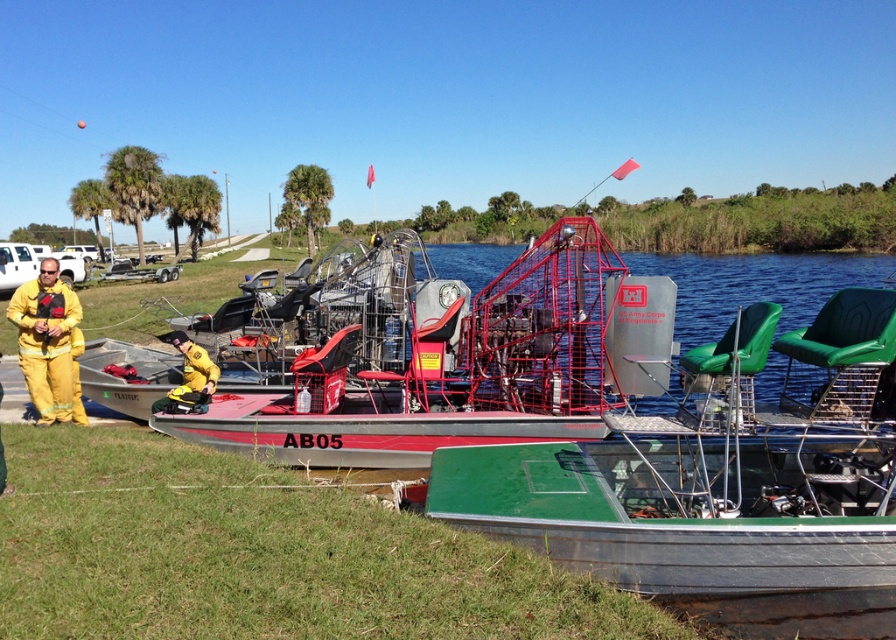
You are a safety inspector at the waterfront. You need to ensure that the yellow fireproof suit at left is placed at least 5 meters away from the green grass at lower left to prevent any accidental fires. Is the current placement compliant with safety regulations?

The distance between the green grass at lower left and the yellow fireproof suit at left is 4.90 meters, which is less than the required 5 meters. Therefore, the current placement does not comply with safety regulations.

You are a photographer positioned at the camera location. You want to take a photo that includes both the point at coordinates point (231, 628) and point (41, 300). Which point will appear larger in the photo?

Point (231, 628) is closer to the camera than point (41, 300), so it will appear larger in the photo.

You are standing at the position of the viewer in the scene. There is a green metallic boat at lower right. If you want to reach it without moving your feet, can you stretch your arms to touch it?

The green metallic boat at lower right is 5.24 meters away from the viewer. Since the average human arm span is about 1.5 to 2 meters, you cannot reach it without moving closer.